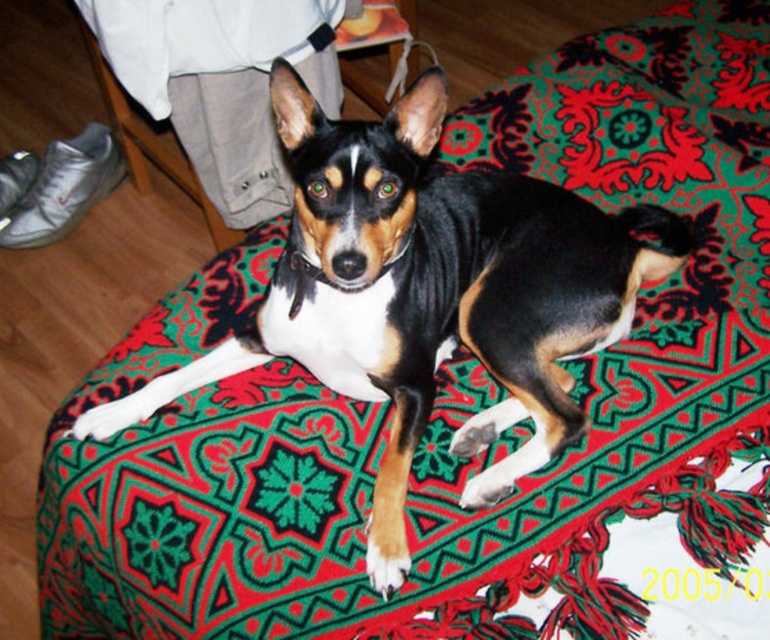
Does black and tan fur dog at center appear on the right side of patterned fabric cushion at center?

Indeed, black and tan fur dog at center is positioned on the right side of patterned fabric cushion at center.

Which is more to the left, black and tan fur dog at center or patterned fabric cushion at center?

patterned fabric cushion at center

Is point (375, 515) positioned after point (129, 136)?

No, it is in front of (129, 136).

Find the location of `black and tan fur dog at center`. black and tan fur dog at center is located at coordinates (427, 292).